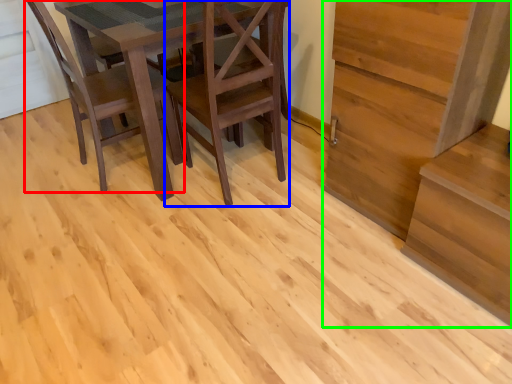
Question: Estimate the real-world distances between objects in this image. Which object is closer to chair (highlighted by a red box), chair (highlighted by a blue box) or stairwell (highlighted by a green box)?

Choices:
 (A) chair
 (B) stairwell

Answer: (A)